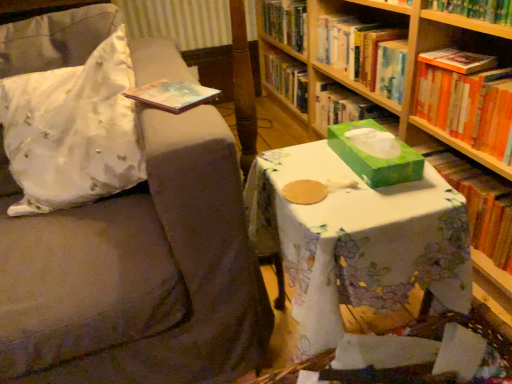
Question: Considering the relative positions of green paper tissue box at center and hardcover book at upper right, the 1th book positioned from the top, in the image provided, is green paper tissue box at center to the right of hardcover book at upper right, the 1th book positioned from the top, from the viewer's perspective?

Choices:
 (A) no
 (B) yes

Answer: (A)

Question: Is green paper tissue box at center thinner than hardcover book at upper right, the 1th book positioned from the top?

Choices:
 (A) no
 (B) yes

Answer: (A)

Question: Is green paper tissue box at center further to the viewer compared to hardcover book at upper right, which appears as the 3th book when ordered from the bottom?

Choices:
 (A) yes
 (B) no

Answer: (B)

Question: Is green paper tissue box at center surrounding hardcover book at upper right, the 1th book positioned from the top?

Choices:
 (A) no
 (B) yes

Answer: (A)

Question: Is the position of green paper tissue box at center less distant than that of hardcover book at upper right, which appears as the 3th book when ordered from the bottom?

Choices:
 (A) no
 (B) yes

Answer: (B)

Question: From a real-world perspective, does green paper tissue box at center sit lower than hardcover book at upper right, the 1th book positioned from the top?

Choices:
 (A) yes
 (B) no

Answer: (B)

Question: Is green cardboard bookcase at center bigger than orange hardcover book at right, placed as the 2th book when sorted from top to bottom?

Choices:
 (A) no
 (B) yes

Answer: (B)

Question: Is green cardboard bookcase at center outside orange hardcover book at right, placed as the 2th book when sorted from top to bottom?

Choices:
 (A) yes
 (B) no

Answer: (A)

Question: Is green cardboard bookcase at center in contact with orange hardcover book at right, placed as the 2th book when sorted from top to bottom?

Choices:
 (A) no
 (B) yes

Answer: (A)

Question: Is green cardboard bookcase at center to the right of orange hardcover book at right, the second book positioned from the bottom, from the viewer's perspective?

Choices:
 (A) no
 (B) yes

Answer: (A)

Question: Does green cardboard bookcase at center come in front of orange hardcover book at right, placed as the 2th book when sorted from top to bottom?

Choices:
 (A) yes
 (B) no

Answer: (A)

Question: Is green cardboard bookcase at center looking in the opposite direction of orange hardcover book at right, the second book positioned from the bottom?

Choices:
 (A) no
 (B) yes

Answer: (B)

Question: Does green paper book at right, which ranks as the 1th book in bottom-to-top order, come behind orange hardcover book at right, the second book positioned from the bottom?

Choices:
 (A) no
 (B) yes

Answer: (B)